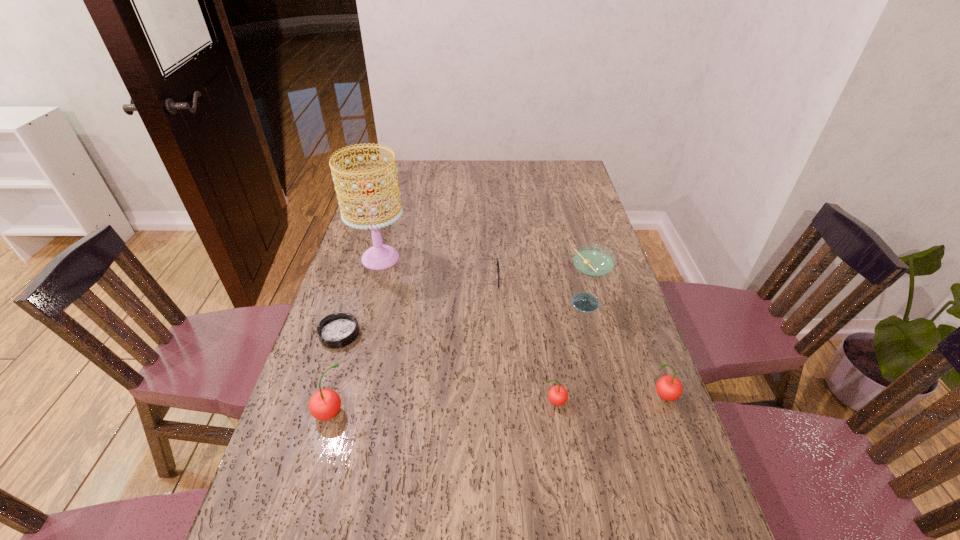
Find the location of a particular element. The height and width of the screenshot is (540, 960). the leftmost cherry is located at coordinates (324, 404).

Find the location of a particular element. the fifth shortest object is located at coordinates (324, 404).

You are a GUI agent. You are given a task and a screenshot of the screen. Output one action in this format:
    pyautogui.click(x=<x>, y=<y>)
    Task: Click on the shortest cherry
    The width and height of the screenshot is (960, 540).
    Given the screenshot: What is the action you would take?
    pyautogui.click(x=558, y=395)

This screenshot has height=540, width=960. I want to click on the third shortest object, so click(558, 395).

At what (x,y) coordinates should I click in order to perform the action: click on the rightmost object. Please return your answer as a coordinate pair (x, y). This screenshot has width=960, height=540. Looking at the image, I should click on 669,388.

Where is `the rightmost cherry`? This screenshot has height=540, width=960. the rightmost cherry is located at coordinates (669, 388).

Image resolution: width=960 pixels, height=540 pixels. I want to click on the second object from right to left, so click(592, 260).

At what (x,y) coordinates should I click in order to perform the action: click on the sixth shortest object. Please return your answer as a coordinate pair (x, y). Image resolution: width=960 pixels, height=540 pixels. Looking at the image, I should click on (592, 260).

Locate an element on the screen. lampshade is located at coordinates (380, 256).

Find the location of a particular element. The height and width of the screenshot is (540, 960). the shortest object is located at coordinates (337, 330).